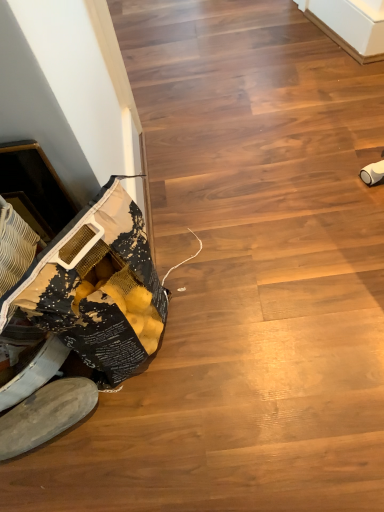
Question: Would you say white suede shoe at lower left is to the left or to the right of wooden floor at lower left in the picture?

Choices:
 (A) left
 (B) right

Answer: (A)

Question: In terms of size, does white suede shoe at lower left appear bigger or smaller than wooden floor at lower left?

Choices:
 (A) small
 (B) big

Answer: (A)

Question: Is point (31, 404) positioned closer to the camera than point (319, 141)?

Choices:
 (A) farther
 (B) closer

Answer: (B)

Question: Considering the relative positions of wooden floor at lower left and white suede shoe at lower left in the image provided, is wooden floor at lower left to the left or to the right of white suede shoe at lower left?

Choices:
 (A) right
 (B) left

Answer: (A)

Question: In terms of height, does wooden floor at lower left look taller or shorter compared to white suede shoe at lower left?

Choices:
 (A) short
 (B) tall

Answer: (A)

Question: In the image, is wooden floor at lower left positioned in front of or behind white suede shoe at lower left?

Choices:
 (A) behind
 (B) front

Answer: (B)

Question: Does point (167, 456) appear closer or farther from the camera than point (28, 439)?

Choices:
 (A) closer
 (B) farther

Answer: (B)